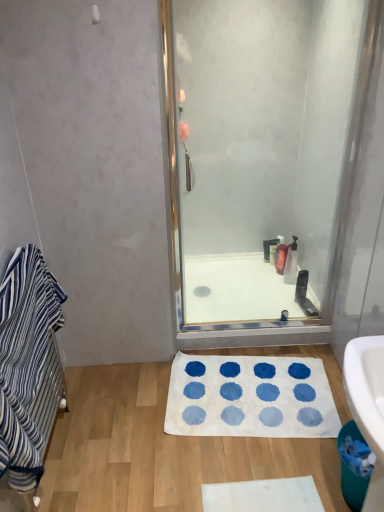
Question: Relative to white glossy bath at center, is translucent plastic soap dispenser at center, arranged as the 2th toiletry when viewed from the back, in front or behind?

Choices:
 (A) behind
 (B) front

Answer: (A)

Question: Is translucent plastic soap dispenser at center, arranged as the 2th toiletry when viewed from the back, spatially inside white glossy bath at center, or outside of it?

Choices:
 (A) inside
 (B) outside

Answer: (B)

Question: Estimate the real-world distances between objects in this image. Which object is farther from the black plastic razor at lower right, arranged as the 4th toiletry when viewed from the back?

Choices:
 (A) white soft bath mat at center
 (B) blue striped towel at left
 (C) translucent plastic soap dispenser at center, placed as the first toiletry when sorted from back to front
 (D) translucent plastic soap dispenser at center, arranged as the 2th toiletry when viewed from the back
 (E) translucent plastic bottle at upper right, marked as the second toiletry in a front-to-back arrangement

Answer: (B)

Question: Estimate the real-world distances between objects in this image. Which object is closer to the translucent plastic soap dispenser at center, placed as the 4th toiletry when sorted from front to back?

Choices:
 (A) white glossy bath at center
 (B) translucent plastic bottle at upper right, marked as the second toiletry in a front-to-back arrangement
 (C) white soft bath mat at center
 (D) blue striped towel at left
 (E) translucent plastic soap dispenser at center, arranged as the 2th toiletry when viewed from the back

Answer: (E)